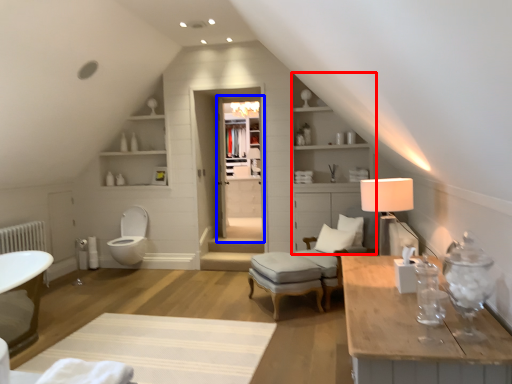
Question: Which of the following is the closest to the observer, dresser (highlighted by a red box) or glass door (highlighted by a blue box)?

Choices:
 (A) dresser
 (B) glass door

Answer: (A)